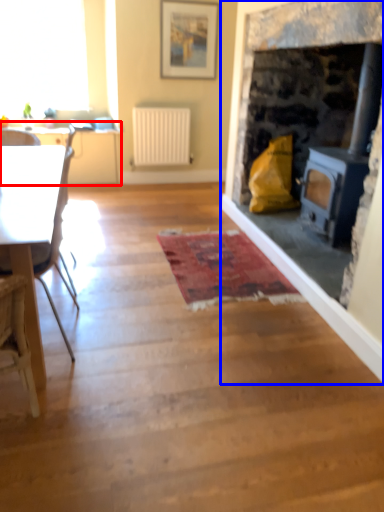
Question: Which object is further to the camera taking this photo, table (highlighted by a red box) or fireplace (highlighted by a blue box)?

Choices:
 (A) table
 (B) fireplace

Answer: (A)